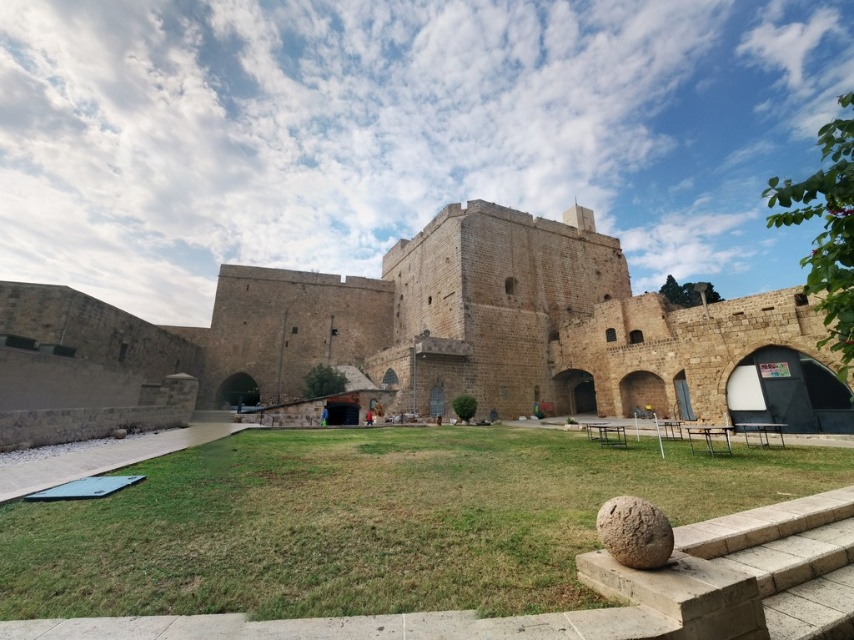
Question: Observing the image, what is the correct spatial positioning of brown stone fort at center in reference to brown rough stone at lower right?

Choices:
 (A) right
 (B) left

Answer: (B)

Question: Is brown stone fort at center to the right of brown rough stone at lower right from the viewer's perspective?

Choices:
 (A) no
 (B) yes

Answer: (A)

Question: Which object appears farthest from the camera in this image?

Choices:
 (A) brown rough stone at lower right
 (B) brown stone fort at center

Answer: (B)

Question: Which of the following is the closest to the observer?

Choices:
 (A) brown rough stone at lower right
 (B) brown stone fort at center

Answer: (A)

Question: Which of the following is the farthest from the observer?

Choices:
 (A) (753, 355)
 (B) (613, 500)

Answer: (A)

Question: Does brown stone fort at center appear over brown rough stone at lower right?

Choices:
 (A) yes
 (B) no

Answer: (A)